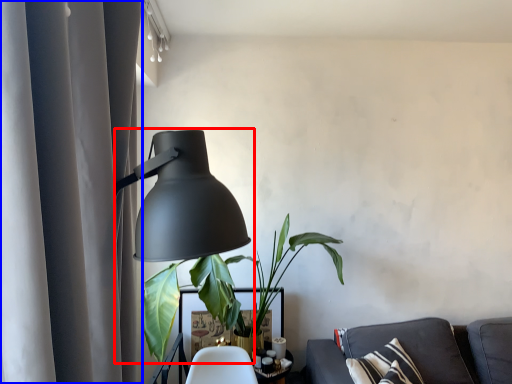
Question: Which object is further to the camera taking this photo, lamp (highlighted by a red box) or curtain (highlighted by a blue box)?

Choices:
 (A) lamp
 (B) curtain

Answer: (A)